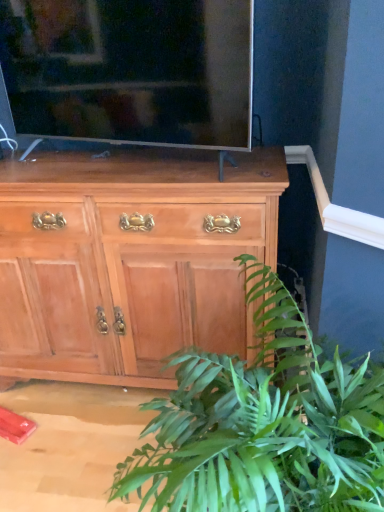
Question: Is green leafy plant at lower right at the back of matte black tv at upper center?

Choices:
 (A) yes
 (B) no

Answer: (B)

Question: From the image's perspective, is matte black tv at upper center under green leafy plant at lower right?

Choices:
 (A) no
 (B) yes

Answer: (A)

Question: From a real-world perspective, is matte black tv at upper center on top of green leafy plant at lower right?

Choices:
 (A) no
 (B) yes

Answer: (B)

Question: Considering the relative sizes of matte black tv at upper center and green leafy plant at lower right in the image provided, is matte black tv at upper center taller than green leafy plant at lower right?

Choices:
 (A) yes
 (B) no

Answer: (B)

Question: Does matte black tv at upper center have a larger size compared to green leafy plant at lower right?

Choices:
 (A) yes
 (B) no

Answer: (B)

Question: From a real-world perspective, is green leafy plant at lower right positioned above or below matte black tv at upper center?

Choices:
 (A) below
 (B) above

Answer: (A)

Question: Considering the positions of point (178, 445) and point (193, 89), is point (178, 445) closer or farther from the camera than point (193, 89)?

Choices:
 (A) farther
 (B) closer

Answer: (B)

Question: From the image's perspective, is green leafy plant at lower right positioned above or below matte black tv at upper center?

Choices:
 (A) above
 (B) below

Answer: (B)

Question: Visually, is green leafy plant at lower right positioned to the left or to the right of matte black tv at upper center?

Choices:
 (A) left
 (B) right

Answer: (B)

Question: In terms of height, does matte black tv at upper center look taller or shorter compared to light brown wood cabinet at center?

Choices:
 (A) short
 (B) tall

Answer: (A)

Question: In the image, is matte black tv at upper center positioned in front of or behind light brown wood cabinet at center?

Choices:
 (A) front
 (B) behind

Answer: (A)

Question: Is point (41, 38) closer or farther from the camera than point (72, 294)?

Choices:
 (A) closer
 (B) farther

Answer: (A)

Question: Is matte black tv at upper center spatially inside light brown wood cabinet at center, or outside of it?

Choices:
 (A) inside
 (B) outside

Answer: (B)

Question: In terms of width, does light brown wood cabinet at center look wider or thinner when compared to green leafy plant at lower right?

Choices:
 (A) thin
 (B) wide

Answer: (A)

Question: In the image, is light brown wood cabinet at center positioned in front of or behind green leafy plant at lower right?

Choices:
 (A) front
 (B) behind

Answer: (B)